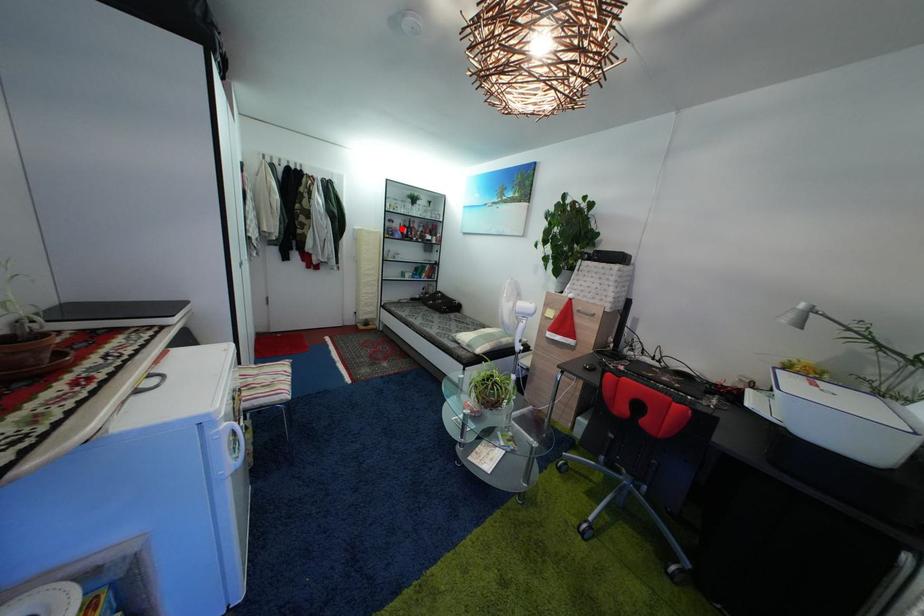
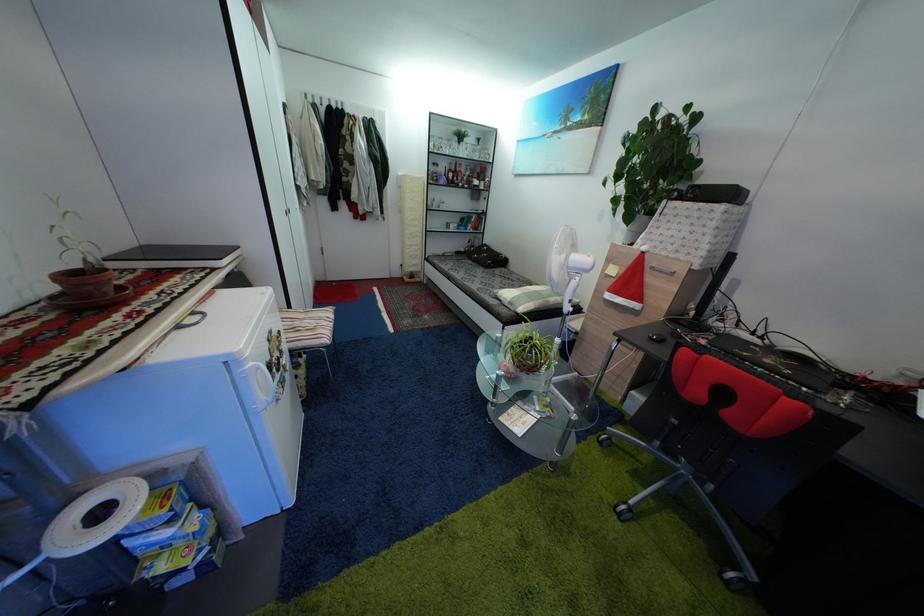
In the second image, find the point that corresponds to the highlighted location in the first image.

(445, 172)